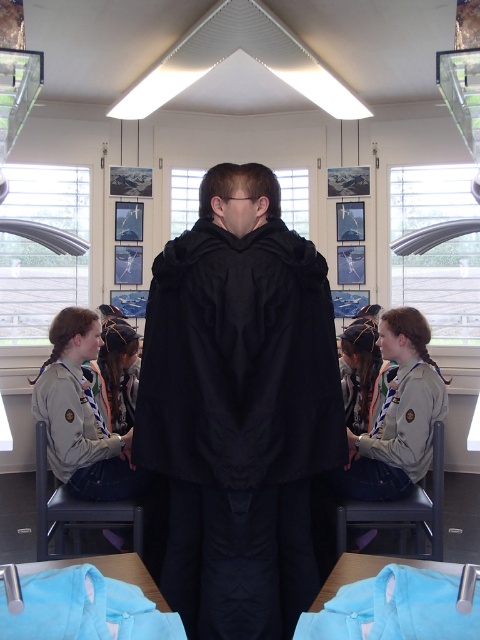
You are an interior designer assessing the space for a new rug. The black matte robe at center and the light blue fabric at lower center are both present in the scene. Which object takes up more space in the room?

The black matte robe at center is larger in size than the light blue fabric at lower center, so it takes up more space in the room.

You are standing in the room and want to walk from the light blue fabric at lower left to the light blue fabric at lower center. Is the path clear?

The light blue fabric at lower center is in front of the light blue fabric at lower left, so the path between them might be blocked by the light blue fabric at lower center.

You are a photographer positioned at the back of the room. You notice the black matte robe at center and the light blue fabric at lower left. Which object is closer to the camera?

The black matte robe at center is closer to the camera because it is positioned over the light blue fabric at lower left, indicating it is in front.